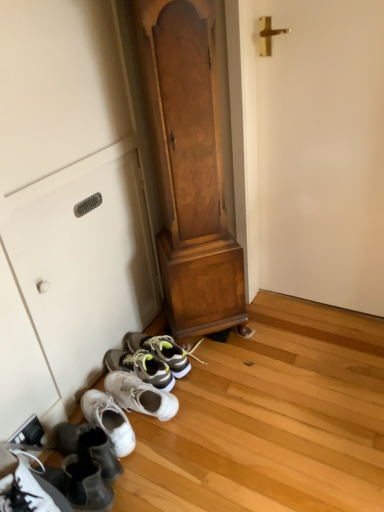
What are the coordinates of `vacant area that is in front of wooden dresser at center` in the screenshot? It's located at (228, 375).